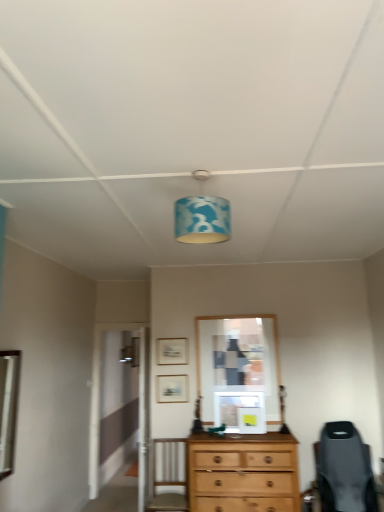
Question: Is matte wooden picture frame at center, which appears as the 2th picture frame when viewed from the back, positioned with its back to silver metallic mirror at left?

Choices:
 (A) no
 (B) yes

Answer: (A)

Question: Is matte wooden picture frame at center, which is counted as the 2th picture frame, starting from the top, next to silver metallic mirror at left?

Choices:
 (A) yes
 (B) no

Answer: (B)

Question: From the image's perspective, is matte wooden picture frame at center, which is the first picture frame in bottom-to-top order, over silver metallic mirror at left?

Choices:
 (A) yes
 (B) no

Answer: (B)

Question: Is matte wooden picture frame at center, which appears as the 2th picture frame when viewed from the back, aimed at silver metallic mirror at left?

Choices:
 (A) no
 (B) yes

Answer: (A)

Question: Does matte wooden picture frame at center, which is the first picture frame in bottom-to-top order, have a greater height compared to silver metallic mirror at left?

Choices:
 (A) no
 (B) yes

Answer: (A)

Question: Is matte wooden picture frame at center, the first picture frame positioned from the front, taller or shorter than blue fabric lampshade at center?

Choices:
 (A) tall
 (B) short

Answer: (B)

Question: From the image's perspective, relative to blue fabric lampshade at center, is matte wooden picture frame at center, the first picture frame positioned from the front, above or below?

Choices:
 (A) below
 (B) above

Answer: (A)

Question: Based on their sizes in the image, would you say matte wooden picture frame at center, which appears as the 2th picture frame when viewed from the back, is bigger or smaller than blue fabric lampshade at center?

Choices:
 (A) small
 (B) big

Answer: (A)

Question: In the image, is matte wooden picture frame at center, which appears as the 2th picture frame when viewed from the back, positioned in front of or behind blue fabric lampshade at center?

Choices:
 (A) front
 (B) behind

Answer: (B)

Question: Based on their sizes in the image, would you say silver metallic mirror at left is bigger or smaller than matte gold picture frame at center, the first picture frame from the top?

Choices:
 (A) big
 (B) small

Answer: (A)

Question: From the image's perspective, relative to matte gold picture frame at center, which is counted as the 2th picture frame, starting from the bottom, is silver metallic mirror at left above or below?

Choices:
 (A) above
 (B) below

Answer: (B)

Question: Based on their positions, is silver metallic mirror at left located to the left or right of matte gold picture frame at center, the 2th picture frame when ordered from front to back?

Choices:
 (A) right
 (B) left

Answer: (B)

Question: Choose the correct answer: Is silver metallic mirror at left inside matte gold picture frame at center, the first picture frame from the top, or outside it?

Choices:
 (A) outside
 (B) inside

Answer: (A)

Question: Considering the positions of matte wooden picture frame at center, the first picture frame positioned from the front, and matte gold picture frame at center, which is the first picture frame in back-to-front order, in the image, is matte wooden picture frame at center, the first picture frame positioned from the front, taller or shorter than matte gold picture frame at center, which is the first picture frame in back-to-front order,?

Choices:
 (A) tall
 (B) short

Answer: (A)

Question: Does point (162, 374) appear closer or farther from the camera than point (165, 352)?

Choices:
 (A) closer
 (B) farther

Answer: (A)